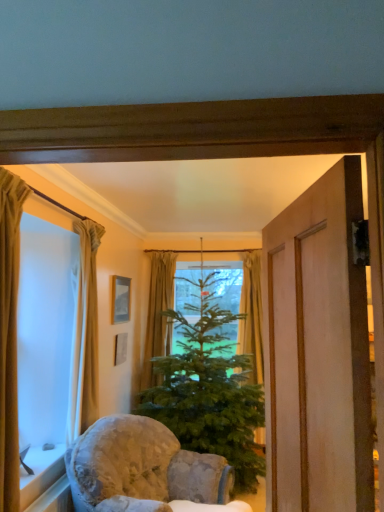
Measure the distance between point [123,298] and camera.

Point [123,298] and camera are 4.30 meters apart from each other.

This screenshot has width=384, height=512. In order to click on matte gray picture frame at center, the first picture frame when ordered from bottom to top in this screenshot , I will do `click(120, 348)`.

Locate an element on the screen. The width and height of the screenshot is (384, 512). beige fabric curtain at left, the 2th curtain in the left-to-right sequence is located at coordinates (85, 335).

The width and height of the screenshot is (384, 512). In order to click on green fabric curtain at center, the 1th curtain viewed from the back in this screenshot , I will do `click(158, 313)`.

This screenshot has height=512, width=384. What do you see at coordinates (158, 313) in the screenshot? I see `green fabric curtain at center, acting as the third curtain starting from the left` at bounding box center [158, 313].

Describe the element at coordinates (209, 389) in the screenshot. I see `green matte christmas tree at center` at that location.

This screenshot has width=384, height=512. Find the location of `fluffy fabric chair at lower center`. fluffy fabric chair at lower center is located at coordinates (142, 468).

Is beige fabric curtain at left, which appears as the first curtain when viewed from the left, turned away from green matte christmas tree at center?

That's not correct — beige fabric curtain at left, which appears as the first curtain when viewed from the left, is not looking away from green matte christmas tree at center.

Looking at this image, is beige fabric curtain at left, the 1th curtain when ordered from front to back, with green matte christmas tree at center?

No, beige fabric curtain at left, the 1th curtain when ordered from front to back, is not in contact with green matte christmas tree at center.

Is beige fabric curtain at left, the 1th curtain when ordered from front to back, outside of green matte christmas tree at center?

Yes, beige fabric curtain at left, the 1th curtain when ordered from front to back, is not within green matte christmas tree at center.

Considering the positions of point (116, 354) and point (255, 370), is point (116, 354) closer or farther from the camera than point (255, 370)?

Point (116, 354).

From the image's perspective, between matte gray picture frame at center, the 2th picture frame when ordered from top to bottom, and green fabric curtain at center, positioned as the 4th curtain in left-to-right order, who is located below?

matte gray picture frame at center, the 2th picture frame when ordered from top to bottom, is shown below in the image.

Considering the positions of objects matte gray picture frame at center, the first picture frame when ordered from bottom to top, and green fabric curtain at center, positioned as the 4th curtain in left-to-right order, in the image provided, who is in front, matte gray picture frame at center, the first picture frame when ordered from bottom to top, or green fabric curtain at center, positioned as the 4th curtain in left-to-right order,?

Positioned in front is matte gray picture frame at center, the first picture frame when ordered from bottom to top.

Which of these two, wooden picture frame at center, acting as the second picture frame starting from the bottom, or fluffy fabric chair at lower center, is bigger?

With larger size is fluffy fabric chair at lower center.

Is wooden picture frame at center, acting as the second picture frame starting from the bottom, wider than fluffy fabric chair at lower center?

In fact, wooden picture frame at center, acting as the second picture frame starting from the bottom, might be narrower than fluffy fabric chair at lower center.

Between point (125, 321) and point (74, 487), which one is positioned in front?

Point (74, 487)

How different are the orientations of wooden picture frame at center, acting as the second picture frame starting from the bottom, and fluffy fabric chair at lower center in degrees?

The angle between the facing direction of wooden picture frame at center, acting as the second picture frame starting from the bottom, and the facing direction of fluffy fabric chair at lower center is 20.1 degrees.

Is beige fabric curtain at left, which appears as the first curtain when viewed from the left, aimed at wooden picture frame at center, marked as the 1th picture frame in a top-to-bottom arrangement?

No, beige fabric curtain at left, which appears as the first curtain when viewed from the left, is not turned towards wooden picture frame at center, marked as the 1th picture frame in a top-to-bottom arrangement.

From a real-world perspective, is beige fabric curtain at left, which appears as the first curtain when viewed from the left, physically below wooden picture frame at center, marked as the 1th picture frame in a top-to-bottom arrangement?

Correct, in the physical world, beige fabric curtain at left, which appears as the first curtain when viewed from the left, is lower than wooden picture frame at center, marked as the 1th picture frame in a top-to-bottom arrangement.

How many degrees apart are the facing directions of beige fabric curtain at left, placed as the fourth curtain when sorted from back to front, and wooden picture frame at center, acting as the second picture frame starting from the bottom?

The angle between the facing direction of beige fabric curtain at left, placed as the fourth curtain when sorted from back to front, and the facing direction of wooden picture frame at center, acting as the second picture frame starting from the bottom, is 3.39 degrees.

Is green fabric curtain at center, which appears as the 2th curtain when viewed from the right, positioned far away from beige fabric curtain at left, which ranks as the third curtain in back-to-front order?

green fabric curtain at center, which appears as the 2th curtain when viewed from the right, is positioned a significant distance from beige fabric curtain at left, which ranks as the third curtain in back-to-front order.

Is green fabric curtain at center, acting as the third curtain starting from the left, facing away from beige fabric curtain at left, marked as the 2th curtain in a front-to-back arrangement?

green fabric curtain at center, acting as the third curtain starting from the left, does not have its back to beige fabric curtain at left, marked as the 2th curtain in a front-to-back arrangement.

Does green fabric curtain at center, acting as the third curtain starting from the left, have a greater width compared to beige fabric curtain at left, the 2th curtain in the left-to-right sequence?

Yes.

Looking at this image, which point is more distant from viewer, (149, 350) or (88, 238)?

The point (149, 350) is behind.

Between green fabric curtain at center, which is the fourth curtain in front-to-back order, and green fabric curtain at center, which is the first curtain in right-to-left order, which one has larger size?

Bigger between the two is green fabric curtain at center, which is the fourth curtain in front-to-back order.

Is green fabric curtain at center, which is the fourth curtain in front-to-back order, shorter than green fabric curtain at center, which appears as the 3th curtain when viewed from the front?

In fact, green fabric curtain at center, which is the fourth curtain in front-to-back order, may be taller than green fabric curtain at center, which appears as the 3th curtain when viewed from the front.

In terms of width, does green fabric curtain at center, acting as the third curtain starting from the left, look wider or thinner when compared to green fabric curtain at center, which is the first curtain in right-to-left order?

Considering their sizes, green fabric curtain at center, acting as the third curtain starting from the left, looks broader than green fabric curtain at center, which is the first curtain in right-to-left order.

Is fluffy fabric chair at lower center a part of matte gray picture frame at center, the 2th picture frame when ordered from top to bottom?

No.

From the image's perspective, starting from the fluffy fabric chair at lower center, which picture frame is the 1st one above? Please provide its 2D coordinates.

[(120, 348)]

Which is further, (115,364) or (74,467)?

Point (115,364)

Is matte gray picture frame at center, the first picture frame when ordered from bottom to top, oriented away from fluffy fabric chair at lower center?

matte gray picture frame at center, the first picture frame when ordered from bottom to top, does not have its back to fluffy fabric chair at lower center.

The width and height of the screenshot is (384, 512). In order to click on christmas tree that appears below the beige fabric curtain at left, which appears as the first curtain when viewed from the left (from a real-world perspective) in this screenshot , I will do `click(209, 389)`.

The width and height of the screenshot is (384, 512). I want to click on the 1st curtain behind the matte gray picture frame at center, the 2th picture frame when ordered from top to bottom, so click(252, 315).

Which object lies further to the anchor point beige fabric curtain at left, placed as the fourth curtain when sorted from back to front, green fabric curtain at center, which appears as the 3th curtain when viewed from the front, or wooden picture frame at center, acting as the second picture frame starting from the bottom?

green fabric curtain at center, which appears as the 3th curtain when viewed from the front, is positioned further to the anchor beige fabric curtain at left, placed as the fourth curtain when sorted from back to front.

Based on their spatial positions, is beige fabric curtain at left, which ranks as the third curtain in back-to-front order, or fluffy fabric chair at lower center closer to green fabric curtain at center, which appears as the 3th curtain when viewed from the front?

Among the two, fluffy fabric chair at lower center is located nearer to green fabric curtain at center, which appears as the 3th curtain when viewed from the front.

Estimate the real-world distances between objects in this image. Which object is further from green fabric curtain at center, acting as the third curtain starting from the left, fluffy fabric chair at lower center or white stone window sill at lower left?

white stone window sill at lower left lies further to green fabric curtain at center, acting as the third curtain starting from the left, than the other object.

Based on their spatial positions, is matte gray picture frame at center, the first picture frame when ordered from bottom to top, or green matte christmas tree at center closer to green fabric curtain at center, positioned as the 4th curtain in left-to-right order?

Based on the image, green matte christmas tree at center appears to be nearer to green fabric curtain at center, positioned as the 4th curtain in left-to-right order.

Looking at the image, which one is located further to green fabric curtain at center, which appears as the 2th curtain when viewed from the right, beige fabric curtain at left, which ranks as the third curtain in back-to-front order, or green fabric curtain at center, positioned as the 4th curtain in left-to-right order?

Among the two, beige fabric curtain at left, which ranks as the third curtain in back-to-front order, is located further to green fabric curtain at center, which appears as the 2th curtain when viewed from the right.

From the image, which object appears to be nearer to white stone window sill at lower left, beige fabric curtain at left, the 1th curtain when ordered from front to back, or green fabric curtain at center, which appears as the 2th curtain when viewed from the right?

Based on the image, beige fabric curtain at left, the 1th curtain when ordered from front to back, appears to be nearer to white stone window sill at lower left.

Estimate the real-world distances between objects in this image. Which object is further from fluffy fabric chair at lower center, white stone window sill at lower left or beige fabric curtain at left, marked as the 2th curtain in a front-to-back arrangement?

beige fabric curtain at left, marked as the 2th curtain in a front-to-back arrangement, is further to fluffy fabric chair at lower center.

From the image, which object appears to be farther from green fabric curtain at center, positioned as the 4th curtain in left-to-right order, green matte christmas tree at center or beige fabric curtain at left, placed as the fourth curtain when sorted from back to front?

beige fabric curtain at left, placed as the fourth curtain when sorted from back to front, is further to green fabric curtain at center, positioned as the 4th curtain in left-to-right order.

Find the location of a particular element. This screenshot has width=384, height=512. christmas tree between fluffy fabric chair at lower center and green fabric curtain at center, acting as the third curtain starting from the left, along the z-axis is located at coordinates (209, 389).

The image size is (384, 512). Identify the location of christmas tree located between fluffy fabric chair at lower center and wooden picture frame at center, marked as the 1th picture frame in a top-to-bottom arrangement, in the depth direction. (209, 389).

At what (x,y) coordinates should I click in order to perform the action: click on picture frame between beige fabric curtain at left, the fourth curtain from the right, and matte gray picture frame at center, the first picture frame when ordered from bottom to top, in the front-back direction. Please return your answer as a coordinate pair (x, y). Looking at the image, I should click on (121, 298).

Where is `picture frame located between matte gray picture frame at center, the 2th picture frame when ordered from top to bottom, and green matte christmas tree at center in the left-right direction`? The width and height of the screenshot is (384, 512). picture frame located between matte gray picture frame at center, the 2th picture frame when ordered from top to bottom, and green matte christmas tree at center in the left-right direction is located at coordinates (121, 298).